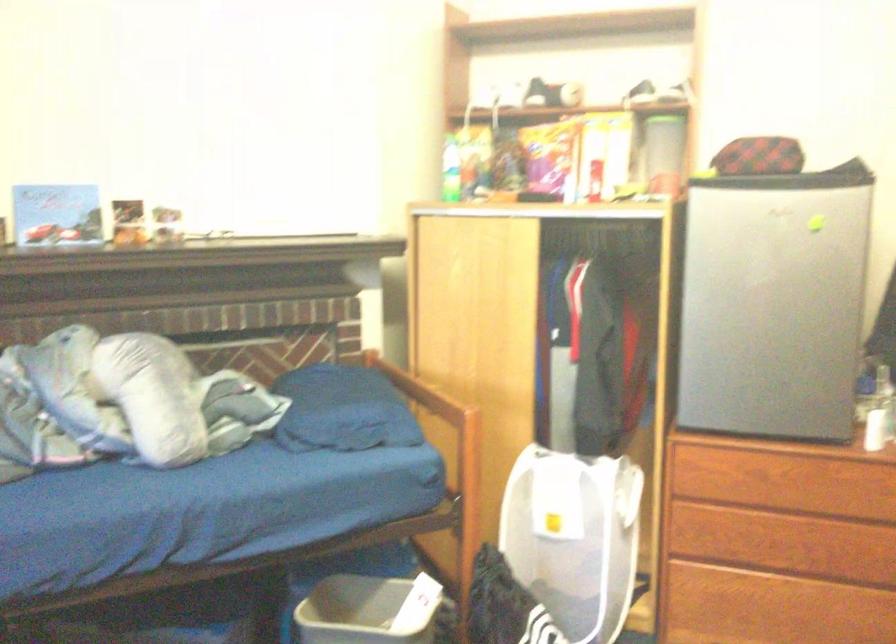
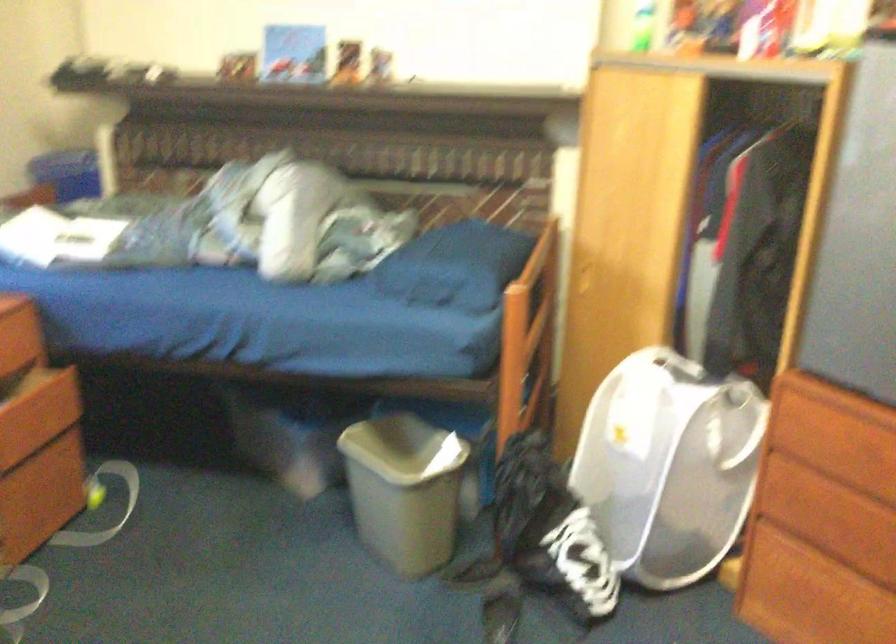
Find the pixel in the second image that matches point (606, 536) in the first image.

(668, 466)